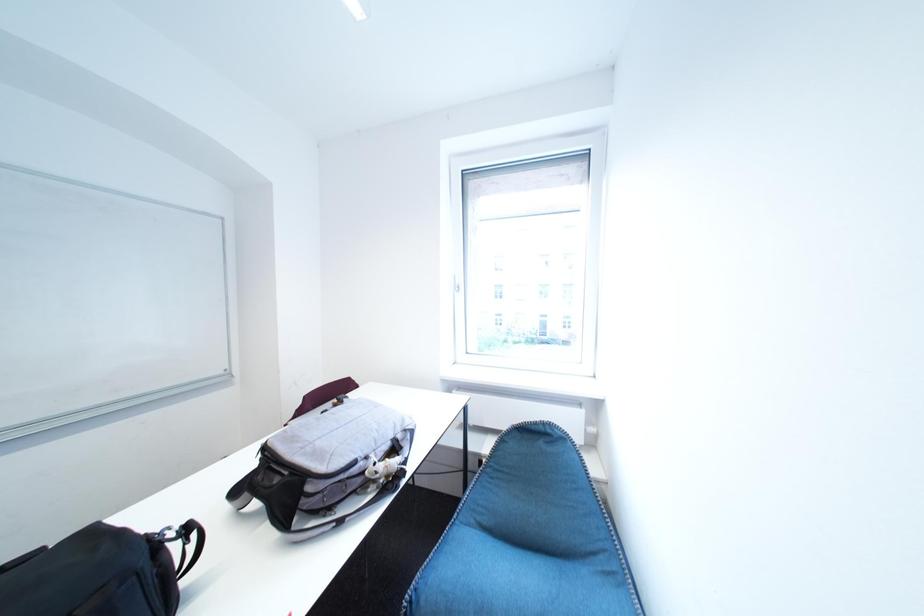
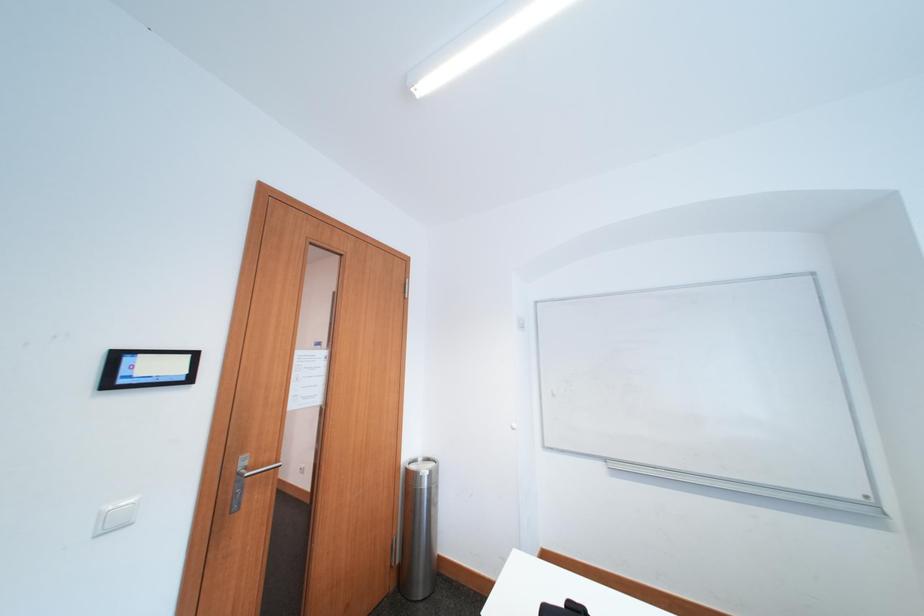
Question: The camera is either moving clockwise (left) or counter-clockwise (right) around the object. The first image is from the beginning of the video and the second image is from the end. Is the camera moving left or right when shooting the video?

Choices:
 (A) Left
 (B) Right

Answer: (B)